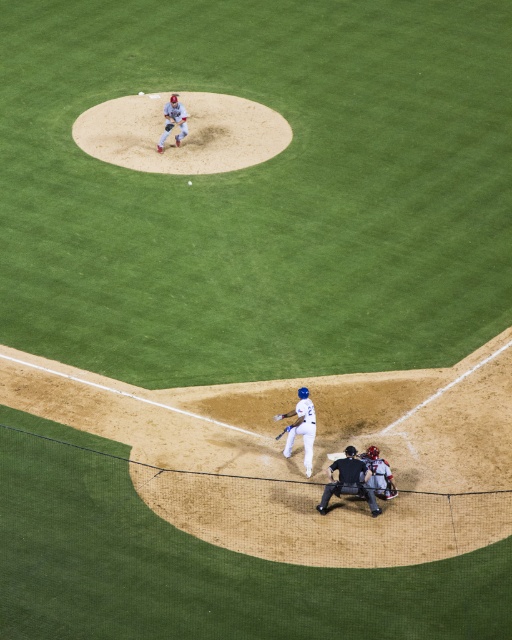
You are a player standing at home plate and need to reach the black leather umpire at lower center quickly. What are the coordinates of the umpire to navigate towards?

The black leather umpire at lower center is located at coordinates point (349, 481), so you should head towards that point to reach them quickly.

Based on the scene description, where is the white matte baseball bat at lower center located in terms of coordinates?

The white matte baseball bat at lower center is located at coordinates point (302, 428).